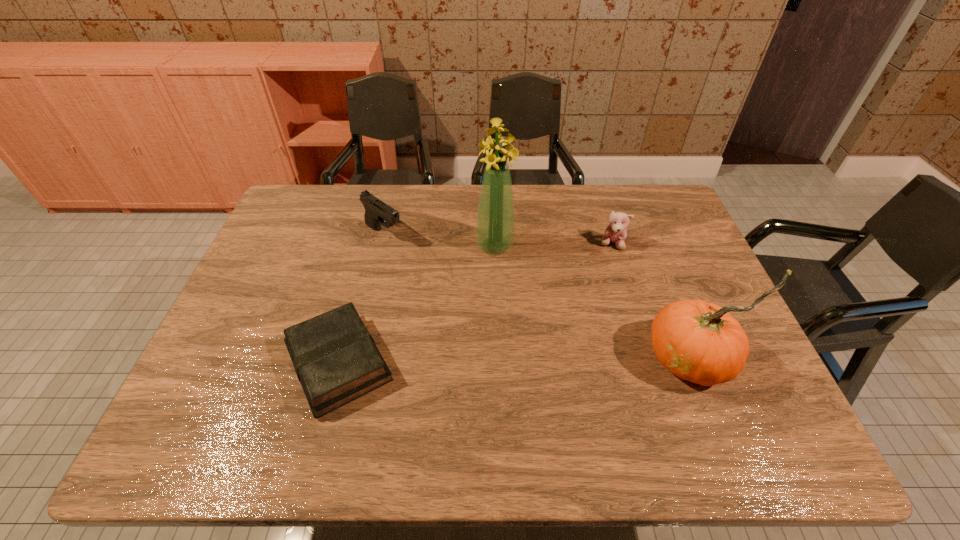
Image resolution: width=960 pixels, height=540 pixels. I want to click on free space located on the front-facing side of the third object from left to right, so 510,301.

Identify the location of vacant region located at the face of the teddy bear. Image resolution: width=960 pixels, height=540 pixels. tap(591, 266).

Where is `vacant space located 0.280m at the face of the teddy bear`? The height and width of the screenshot is (540, 960). vacant space located 0.280m at the face of the teddy bear is located at coordinates (557, 303).

The image size is (960, 540). In order to click on free space located at the face of the teddy bear in this screenshot , I will do `click(553, 308)`.

Find the location of a particular element. The image size is (960, 540). vacant space situated at the barrel of the pistol is located at coordinates (468, 294).

Locate an element on the screen. This screenshot has width=960, height=540. free space located at the barrel of the pistol is located at coordinates pos(448,280).

Where is `free spot located at the barrel of the pistol`? This screenshot has height=540, width=960. free spot located at the barrel of the pistol is located at coordinates (444, 276).

In order to click on object that is at the far edge in this screenshot , I will do point(376,211).

The height and width of the screenshot is (540, 960). I want to click on book located in the near edge section of the desktop, so click(x=336, y=360).

Locate an element on the screen. The width and height of the screenshot is (960, 540). pumpkin that is positioned at the near edge is located at coordinates (701, 342).